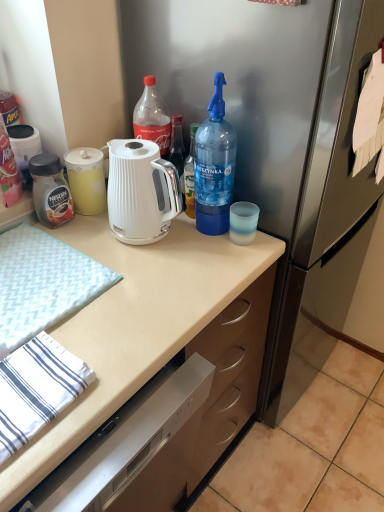
At what (x,y) coordinates should I click in order to perform the action: click on white glossy electric kettle at center. Please return your answer as a coordinate pair (x, y). The height and width of the screenshot is (512, 384). Looking at the image, I should click on (141, 192).

Measure the distance between white glossy electric kettle at center and camera.

The depth of white glossy electric kettle at center is 38.91 inches.

Locate an element on the screen. This screenshot has height=512, width=384. white glossy electric kettle at center is located at coordinates coord(141,192).

How much distance is there between matte black jar at left, the 2th bottle from the right, and white glossy electric kettle at center?

9.12 inches.

From the image's perspective, does matte black jar at left, the 2th bottle from the right, appear lower than white glossy electric kettle at center?

No, from the image's perspective, matte black jar at left, the 2th bottle from the right, is not below white glossy electric kettle at center.

Which object is closer to the camera, matte black jar at left, the 2th bottle from the right, or white glossy electric kettle at center?

Positioned in front is white glossy electric kettle at center.

Considering the points (58, 194) and (133, 161), which point is behind, point (58, 194) or point (133, 161)?

The point (58, 194) is behind.

Choose the correct answer: Is white glossy electric kettle at center inside blue translucent bottle at right, the third bottle in the left-to-right sequence, or outside it?

white glossy electric kettle at center is located beyond the bounds of blue translucent bottle at right, the third bottle in the left-to-right sequence.

Is white glossy electric kettle at center directly adjacent to blue translucent bottle at right, the 1th bottle when ordered from right to left?

No, white glossy electric kettle at center is not making contact with blue translucent bottle at right, the 1th bottle when ordered from right to left.

From the image's perspective, is white glossy electric kettle at center located above or below blue translucent bottle at right, the third bottle in the left-to-right sequence?

From the image's perspective, white glossy electric kettle at center appears below blue translucent bottle at right, the third bottle in the left-to-right sequence.

Would you say white glossy electric kettle at center is to the left or to the right of blue translucent bottle at right, the third bottle in the left-to-right sequence, in the picture?

white glossy electric kettle at center is to the left of blue translucent bottle at right, the third bottle in the left-to-right sequence.

From the image's perspective, which is below, white matte countertop at center or matte black jar at left, arranged as the third bottle when viewed from the right?

white matte countertop at center is shown below in the image.

Does point (95, 362) lie in front of point (14, 161)?

Yes, point (95, 362) is closer to viewer.

Looking at the image, does white matte countertop at center seem bigger or smaller compared to matte black jar at left, arranged as the third bottle when viewed from the right?

white matte countertop at center is bigger than matte black jar at left, arranged as the third bottle when viewed from the right.

Between white matte countertop at center and matte black jar at left, arranged as the third bottle when viewed from the right, which one appears on the left side from the viewer's perspective?

Positioned to the left is matte black jar at left, arranged as the third bottle when viewed from the right.

Considering the positions of points (220, 103) and (155, 179), is point (220, 103) farther from camera compared to point (155, 179)?

No.

From a real-world perspective, is blue translucent bottle at right, the 1th bottle when ordered from right to left, on white glossy electric kettle at center?

Yes, from a real-world perspective, blue translucent bottle at right, the 1th bottle when ordered from right to left, is on top of white glossy electric kettle at center.

Is the position of blue translucent bottle at right, the 1th bottle when ordered from right to left, more distant than that of white glossy electric kettle at center?

No, blue translucent bottle at right, the 1th bottle when ordered from right to left, is closer to the camera.

Does blue translucent bottle at right, the third bottle in the left-to-right sequence, turn towards white glossy electric kettle at center?

No.

How different are the orientations of white matte countertop at center and white textured hand towel at left in degrees?

0.805 degrees.

The width and height of the screenshot is (384, 512). Identify the location of cabinetry on the right side of white textured hand towel at left. (133, 326).

Which is closer to the camera, (155, 369) or (30, 250)?

The point (155, 369) is closer.

Is white matte countertop at center positioned with its back to white textured hand towel at left?

No.

Image resolution: width=384 pixels, height=512 pixels. In order to click on hand towel that appears on the left of matte black jar at left, which is the 2th bottle in left-to-right order in this screenshot , I will do `click(43, 284)`.

Between white textured hand towel at left and matte black jar at left, the 2th bottle from the right, which one is positioned in front?

white textured hand towel at left is more forward.

Can we say white textured hand towel at left lies outside matte black jar at left, the 2th bottle from the right?

Yes, white textured hand towel at left is located beyond the bounds of matte black jar at left, the 2th bottle from the right.

What's the angular difference between white textured hand towel at left and matte black jar at left, which is the 2th bottle in left-to-right order,'s facing directions?

2.27 degrees separate the facing orientations of white textured hand towel at left and matte black jar at left, which is the 2th bottle in left-to-right order.

Looking at this image, would you say white glossy electric kettle at center is outside matte black jar at left, the 2th bottle from the right?

That's correct, white glossy electric kettle at center is outside of matte black jar at left, the 2th bottle from the right.

Which is behind, white glossy electric kettle at center or matte black jar at left, the 2th bottle from the right?

matte black jar at left, the 2th bottle from the right, is more distant.

Is white glossy electric kettle at center aimed at matte black jar at left, the 2th bottle from the right?

No, white glossy electric kettle at center is not oriented towards matte black jar at left, the 2th bottle from the right.

The height and width of the screenshot is (512, 384). I want to click on kettle below the matte black jar at left, which is the 2th bottle in left-to-right order (from the image's perspective), so click(141, 192).

Image resolution: width=384 pixels, height=512 pixels. Identify the location of kettle that appears on the right of matte black jar at left, which is the 2th bottle in left-to-right order. (141, 192).

The image size is (384, 512). In order to click on kettle below the blue translucent bottle at right, the 1th bottle when ordered from right to left (from the image's perspective) in this screenshot , I will do [141, 192].

Considering their positions, is white matte countertop at center positioned closer to blue translucent bottle at right, the third bottle in the left-to-right sequence, than matte black jar at left, which is the 2th bottle in left-to-right order?

The object closer to blue translucent bottle at right, the third bottle in the left-to-right sequence, is white matte countertop at center.

When comparing their distances from white textured hand towel at left, does blue translucent bottle at right, the 1th bottle when ordered from right to left, or matte black jar at left, the 2th bottle from the right, seem closer?

Based on the image, matte black jar at left, the 2th bottle from the right, appears to be nearer to white textured hand towel at left.

From the picture: When comparing their distances from white textured hand towel at left, does white glossy electric kettle at center or matte black jar at left, arranged as the third bottle when viewed from the right, seem further?

The object further to white textured hand towel at left is matte black jar at left, arranged as the third bottle when viewed from the right.

Looking at this image, which object lies further to the anchor point blue translucent bottle at right, the third bottle in the left-to-right sequence, matte black jar at left, arranged as the third bottle when viewed from the right, or matte black jar at left, which is the 2th bottle in left-to-right order?

The object further to blue translucent bottle at right, the third bottle in the left-to-right sequence, is matte black jar at left, arranged as the third bottle when viewed from the right.

Estimate the real-world distances between objects in this image. Which object is further from white matte countertop at center, white glossy electric kettle at center or blue translucent bottle at right, the third bottle in the left-to-right sequence?

blue translucent bottle at right, the third bottle in the left-to-right sequence.

Looking at the image, which one is located closer to matte black jar at left, which is the 2th bottle in left-to-right order, white glossy electric kettle at center or matte black jar at left, which is the 1th bottle from left to right?

Among the two, matte black jar at left, which is the 1th bottle from left to right, is located nearer to matte black jar at left, which is the 2th bottle in left-to-right order.

From the picture: Based on their spatial positions, is matte black jar at left, arranged as the third bottle when viewed from the right, or matte black jar at left, the 2th bottle from the right, closer to white glossy electric kettle at center?

The object closer to white glossy electric kettle at center is matte black jar at left, the 2th bottle from the right.

When comparing their distances from white textured hand towel at left, does matte black jar at left, which is the 1th bottle from left to right, or white matte countertop at center seem closer?

white matte countertop at center is closer to white textured hand towel at left.

Where is `bottle located between white textured hand towel at left and blue translucent bottle at right, the 1th bottle when ordered from right to left, in the left-right direction`? The width and height of the screenshot is (384, 512). bottle located between white textured hand towel at left and blue translucent bottle at right, the 1th bottle when ordered from right to left, in the left-right direction is located at coordinates (50, 190).

The width and height of the screenshot is (384, 512). Find the location of `hand towel that lies between white glossy electric kettle at center and white matte countertop at center from top to bottom`. hand towel that lies between white glossy electric kettle at center and white matte countertop at center from top to bottom is located at coordinates (43, 284).

The image size is (384, 512). I want to click on hand towel between matte black jar at left, which is the 1th bottle from left to right, and white matte countertop at center from top to bottom, so click(x=43, y=284).

Locate an element on the screen. hand towel between blue translucent bottle at right, the third bottle in the left-to-right sequence, and white matte countertop at center, in the vertical direction is located at coordinates (43, 284).